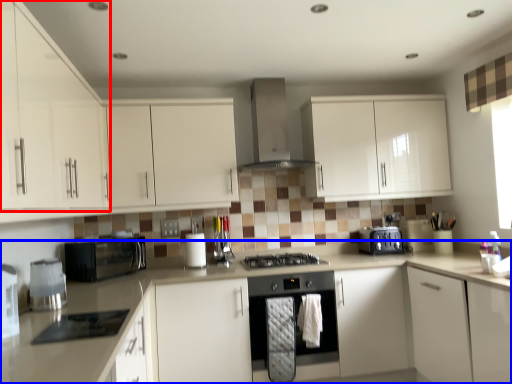
Question: Which object is closer to the camera taking this photo, cabinetry (highlighted by a red box) or countertop (highlighted by a blue box)?

Choices:
 (A) cabinetry
 (B) countertop

Answer: (B)